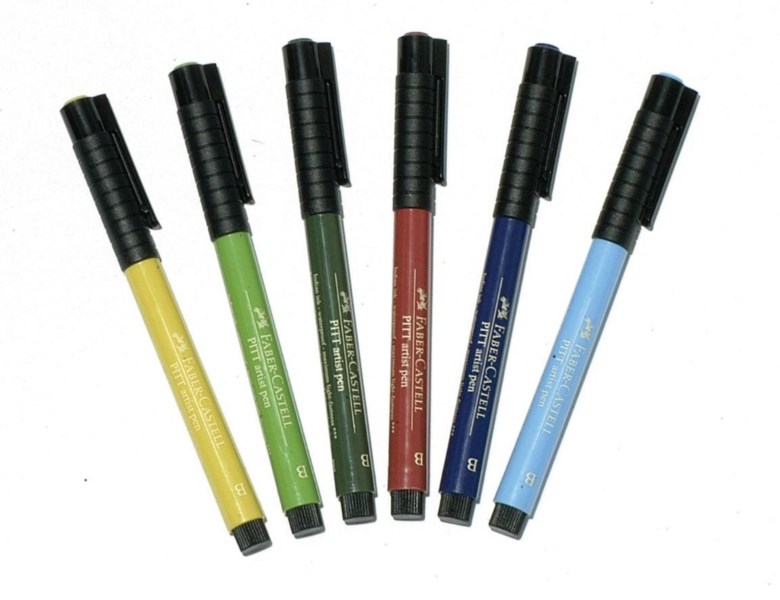
This screenshot has width=780, height=600. I want to click on pen, so click(218, 182), click(126, 215), click(302, 123), click(416, 90), click(548, 117), click(649, 178).